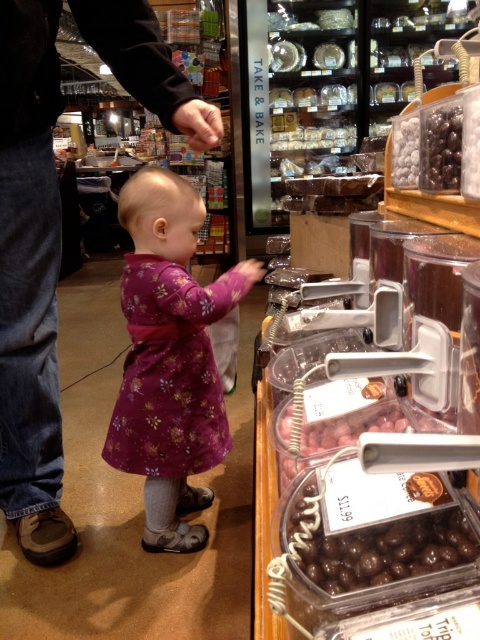
Is shiny chocolate balls at lower right to the left of shiny chocolate candy at right from the viewer's perspective?

Yes, shiny chocolate balls at lower right is to the left of shiny chocolate candy at right.

Is shiny chocolate balls at lower right wider than shiny chocolate candy at right?

Indeed, shiny chocolate balls at lower right has a greater width compared to shiny chocolate candy at right.

The image size is (480, 640). I want to click on shiny chocolate balls at lower right, so click(388, 550).

Is point (169, 513) behind point (478, 160)?

Yes, point (169, 513) is behind point (478, 160).

Which of these two, purple floral dress at center or shiny chocolate candy at right, stands taller?

With more height is purple floral dress at center.

The width and height of the screenshot is (480, 640). Find the location of `purple floral dress at center`. purple floral dress at center is located at coordinates (169, 358).

At what (x,y) coordinates should I click in order to perform the action: click on purple floral dress at center. Please return your answer as a coordinate pair (x, y). Image resolution: width=480 pixels, height=640 pixels. Looking at the image, I should click on (169, 358).

Does shiny chocolate candy at upper right appear under shiny chocolate candy at right?

No.

Can you confirm if shiny chocolate candy at upper right is positioned above shiny chocolate candy at right?

Correct, shiny chocolate candy at upper right is located above shiny chocolate candy at right.

Between point (433, 188) and point (476, 131), which one is positioned behind?

The point (433, 188) is behind.

Locate an element on the screen. This screenshot has height=640, width=480. shiny chocolate candy at upper right is located at coordinates (441, 145).